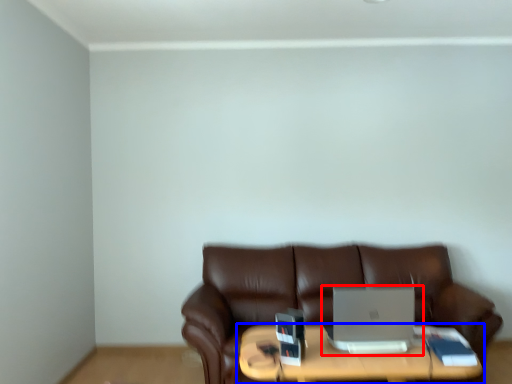
Question: Which point is closer to the camera, laptop (highlighted by a red box) or table (highlighted by a blue box)?

Choices:
 (A) laptop
 (B) table

Answer: (B)